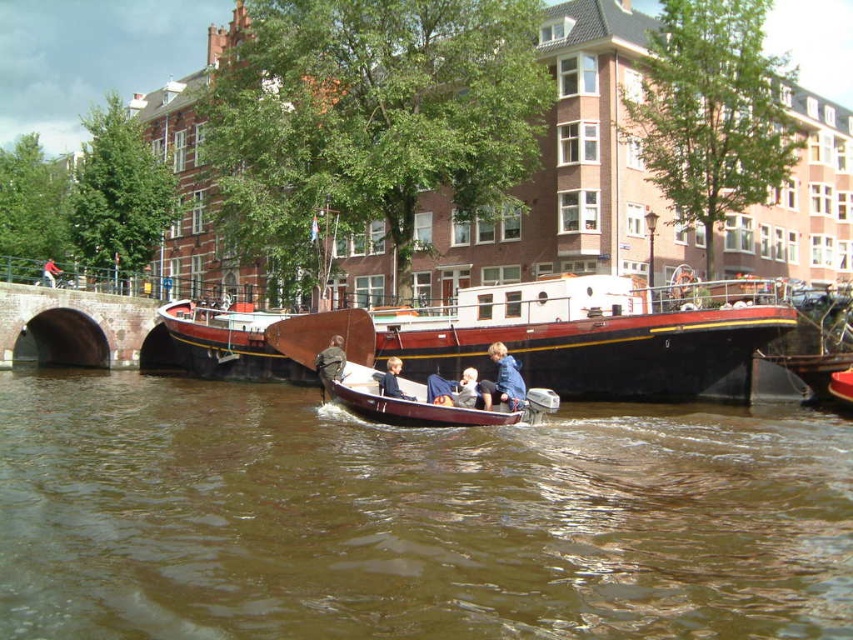
Question: Is brown water at center to the left of dark brown stone bridge at lower left from the viewer's perspective?

Choices:
 (A) yes
 (B) no

Answer: (B)

Question: Among these objects, which one is farthest from the camera?

Choices:
 (A) brown leather jacket at center
 (B) light blue fabric jacket at center
 (C) dark brown stone bridge at lower left
 (D) smooth beige baby at center

Answer: (C)

Question: Which object is farther from the camera taking this photo?

Choices:
 (A) smooth beige baby at center
 (B) blue denim jacket at lower center
 (C) dark brown stone bridge at lower left
 (D) wooden polished boat at center

Answer: (C)

Question: Which of the following is the closest to the observer?

Choices:
 (A) blue denim jacket at lower center
 (B) light blue fabric jacket at center
 (C) wooden polished boat at center
 (D) smooth beige baby at center

Answer: (C)

Question: Is rustic wood boat at center further to camera compared to light blue fabric jacket at center?

Choices:
 (A) yes
 (B) no

Answer: (A)

Question: Is blue denim jacket at lower center to the right of brown leather jacket at center from the viewer's perspective?

Choices:
 (A) yes
 (B) no

Answer: (A)